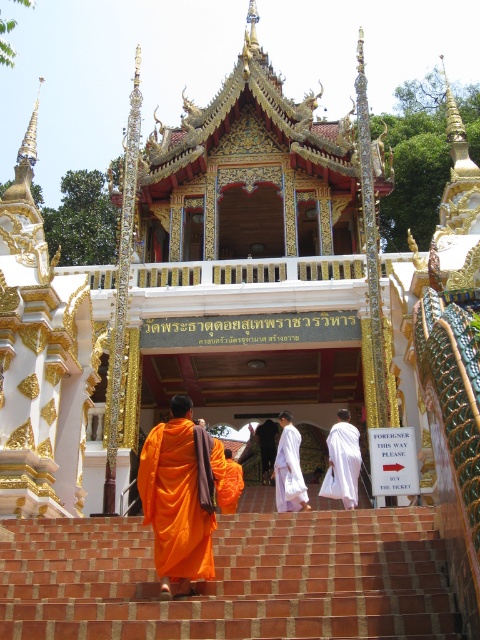
Question: Does orange cloth at center appear on the left side of white silk robe at center?

Choices:
 (A) no
 (B) yes

Answer: (B)

Question: Which is nearer to the terracotta brick stairs at center?

Choices:
 (A) white matte robe at center
 (B) white silk robe at center

Answer: (A)

Question: Does terracotta brick stairs at center have a lesser width compared to orange cloth at center?

Choices:
 (A) yes
 (B) no

Answer: (B)

Question: Is terracotta brick stairs at center positioned behind orange cloth at center?

Choices:
 (A) no
 (B) yes

Answer: (A)

Question: Which point appears farthest from the camera in this image?

Choices:
 (A) (177, 532)
 (B) (339, 444)

Answer: (B)

Question: Which object is the closest to the white matte robe at center?

Choices:
 (A) white silk robe at center
 (B) terracotta brick stairs at center

Answer: (A)